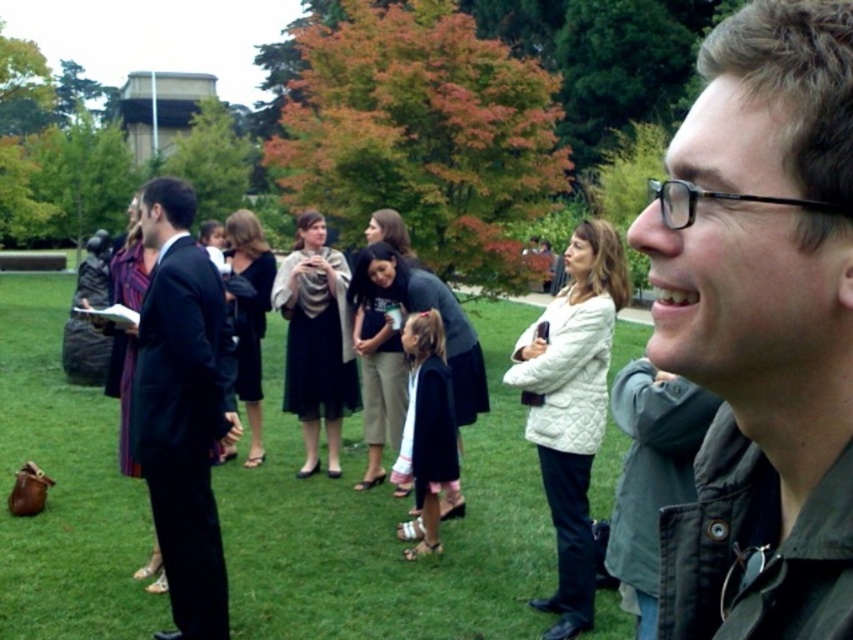
Question: Among these objects, which one is nearest to the camera?

Choices:
 (A) black suit at left
 (B) dark gray sweater at center

Answer: (A)

Question: Is dark green jacket at center positioned in front of green grass at center?

Choices:
 (A) no
 (B) yes

Answer: (B)

Question: Based on their relative distances, which object is farther from the dark gray sweater at center?

Choices:
 (A) dark blue fabric dress at center
 (B) white quilted jacket at center
 (C) green grass at center
 (D) dark gray dress at center

Answer: (C)

Question: Which point is farther from the camera taking this photo?

Choices:
 (A) (164, 506)
 (B) (306, 252)
 (C) (129, 381)

Answer: (B)

Question: Is green grass at center further to camera compared to dark blue fabric dress at center?

Choices:
 (A) yes
 (B) no

Answer: (B)

Question: Where is green grass at center located in relation to dark gray knit sweater at center in the image?

Choices:
 (A) left
 (B) right

Answer: (A)